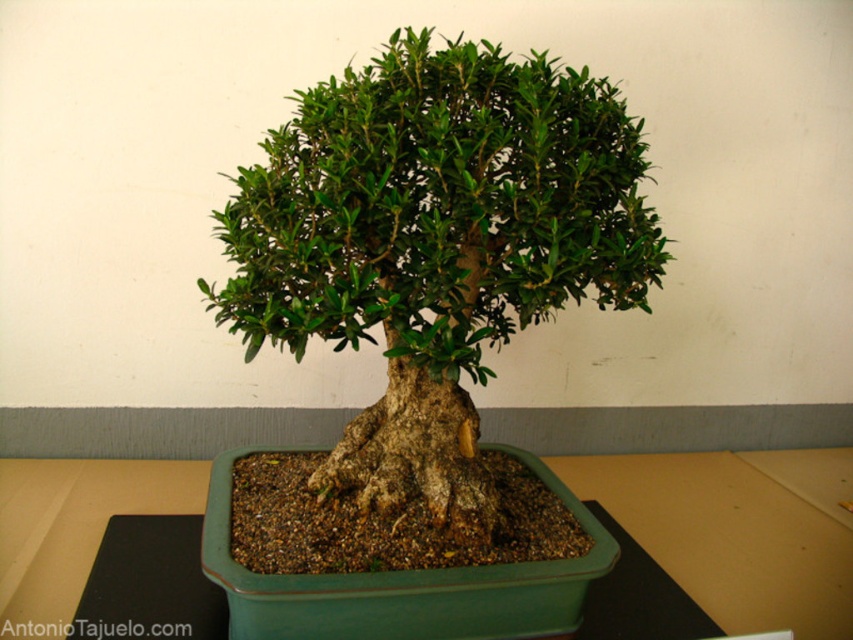
Question: Which of the following is the farthest from the observer?

Choices:
 (A) (386, 116)
 (B) (161, 538)

Answer: (B)

Question: Among these objects, which one is farthest from the camera?

Choices:
 (A) green ceramic pot at center
 (B) green matte bonsai tree at center

Answer: (A)

Question: Where is green matte bonsai tree at center located in relation to green ceramic pot at center in the image?

Choices:
 (A) right
 (B) left

Answer: (A)

Question: Can you confirm if green matte bonsai tree at center is wider than green ceramic pot at center?

Choices:
 (A) yes
 (B) no

Answer: (A)

Question: Is green matte bonsai tree at center closer to the viewer compared to green ceramic pot at center?

Choices:
 (A) no
 (B) yes

Answer: (B)